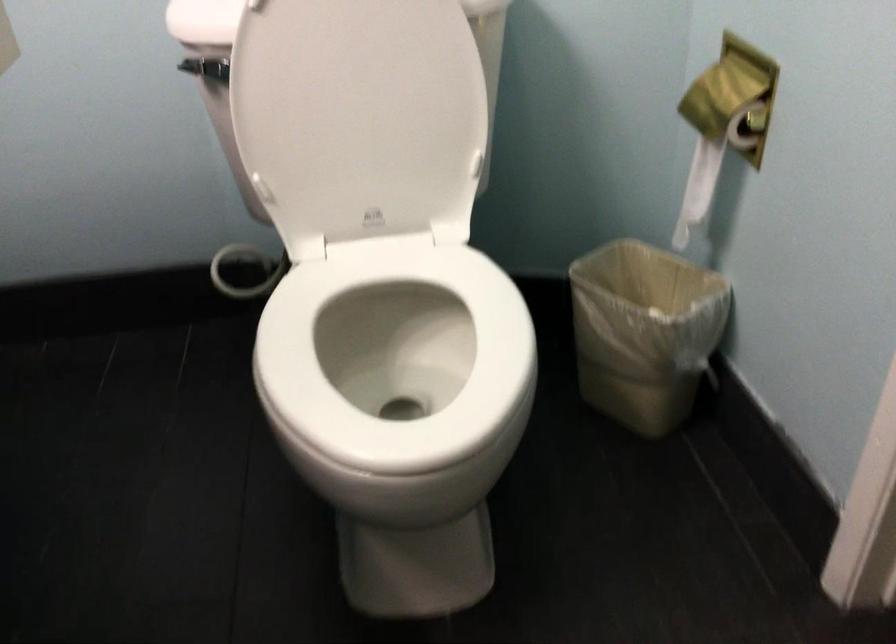
Where would you lift the white toilet lid? Please return your answer as a coordinate pair (x, y).

(359, 114)